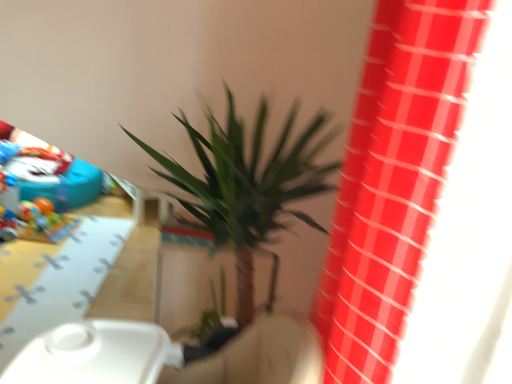
The height and width of the screenshot is (384, 512). What are the coordinates of `glossy plastic curtain at upper right` in the screenshot? It's located at (393, 178).

In terms of height, does green leafy plant at center look taller or shorter compared to yellow matte table at lower left?

Considering their sizes, green leafy plant at center has more height than yellow matte table at lower left.

Is green leafy plant at center far from yellow matte table at lower left?

green leafy plant at center is positioned a significant distance from yellow matte table at lower left.

Considering the relative positions of green leafy plant at center and yellow matte table at lower left in the image provided, is green leafy plant at center to the left or to the right of yellow matte table at lower left?

green leafy plant at center is positioned on yellow matte table at lower left's right side.

Does point (275, 203) come in front of point (102, 244)?

Yes.

Is glossy plastic curtain at upper right bigger or smaller than green leafy plant at center?

glossy plastic curtain at upper right is smaller than green leafy plant at center.

Can you confirm if glossy plastic curtain at upper right is wider than green leafy plant at center?

No, glossy plastic curtain at upper right is not wider than green leafy plant at center.

Is glossy plastic curtain at upper right placed right next to green leafy plant at center?

No, glossy plastic curtain at upper right is not with green leafy plant at center.

Considering the points (450, 30) and (312, 149), which point is behind, point (450, 30) or point (312, 149)?

The point (312, 149) is more distant.

Can you confirm if glossy plastic curtain at upper right is taller than yellow matte table at lower left?

Correct, glossy plastic curtain at upper right is much taller as yellow matte table at lower left.

Which is behind, point (357, 311) or point (71, 249)?

The point (71, 249) is behind.

Could you tell me if glossy plastic curtain at upper right is facing yellow matte table at lower left?

No, glossy plastic curtain at upper right is not turned towards yellow matte table at lower left.

Looking at this image, from a real-world perspective, is glossy plastic curtain at upper right positioned above or below yellow matte table at lower left?

glossy plastic curtain at upper right is above yellow matte table at lower left.

Does yellow matte table at lower left turn towards glossy plastic curtain at upper right?

No, yellow matte table at lower left is not facing towards glossy plastic curtain at upper right.

Who is bigger, yellow matte table at lower left or glossy plastic curtain at upper right?

With larger size is glossy plastic curtain at upper right.

Between yellow matte table at lower left and glossy plastic curtain at upper right, which one is positioned behind?

yellow matte table at lower left.

In terms of width, does yellow matte table at lower left look wider or thinner when compared to glossy plastic curtain at upper right?

Considering their sizes, yellow matte table at lower left looks broader than glossy plastic curtain at upper right.

Based on the photo, is green leafy plant at center surrounding glossy plastic curtain at upper right?

Definitely not — glossy plastic curtain at upper right is not inside green leafy plant at center.

Is green leafy plant at center bigger or smaller than glossy plastic curtain at upper right?

Clearly, green leafy plant at center is larger in size than glossy plastic curtain at upper right.

Does green leafy plant at center have a lesser height compared to glossy plastic curtain at upper right?

In fact, green leafy plant at center may be taller than glossy plastic curtain at upper right.

From a real-world perspective, which object stands above the other?

glossy plastic curtain at upper right.

Is yellow matte table at lower left not close to green leafy plant at center?

That's right, there is a large distance between yellow matte table at lower left and green leafy plant at center.

From the image's perspective, is yellow matte table at lower left on top of green leafy plant at center?

No.

Find the location of `table located below the green leafy plant at center (from the image's perspective)`. table located below the green leafy plant at center (from the image's perspective) is located at coordinates (64, 282).

At what (x,y) coordinates should I click in order to perform the action: click on table lying below the green leafy plant at center (from the image's perspective). Please return your answer as a coordinate pair (x, y). This screenshot has width=512, height=384. Looking at the image, I should click on (64, 282).

Where is `curtain on the right side of green leafy plant at center`? The height and width of the screenshot is (384, 512). curtain on the right side of green leafy plant at center is located at coordinates (393, 178).

In the scene shown: Considering their positions, is green leafy plant at center positioned further to yellow matte table at lower left than glossy plastic curtain at upper right?

Among the two, glossy plastic curtain at upper right is located further to yellow matte table at lower left.

Estimate the real-world distances between objects in this image. Which object is further from green leafy plant at center, yellow matte table at lower left or glossy plastic curtain at upper right?

yellow matte table at lower left lies further to green leafy plant at center than the other object.

Looking at the image, which one is located closer to green leafy plant at center, glossy plastic curtain at upper right or yellow matte table at lower left?

glossy plastic curtain at upper right is positioned closer to the anchor green leafy plant at center.

Based on their spatial positions, is yellow matte table at lower left or green leafy plant at center further from glossy plastic curtain at upper right?

Based on the image, yellow matte table at lower left appears to be further to glossy plastic curtain at upper right.

Which object lies further to the anchor point glossy plastic curtain at upper right, green leafy plant at center or yellow matte table at lower left?

Based on the image, yellow matte table at lower left appears to be further to glossy plastic curtain at upper right.

Considering their positions, is glossy plastic curtain at upper right positioned closer to yellow matte table at lower left than green leafy plant at center?

Based on the image, green leafy plant at center appears to be nearer to yellow matte table at lower left.

Locate an element on the screen. houseplant located between yellow matte table at lower left and glossy plastic curtain at upper right in the left-right direction is located at coordinates (247, 184).